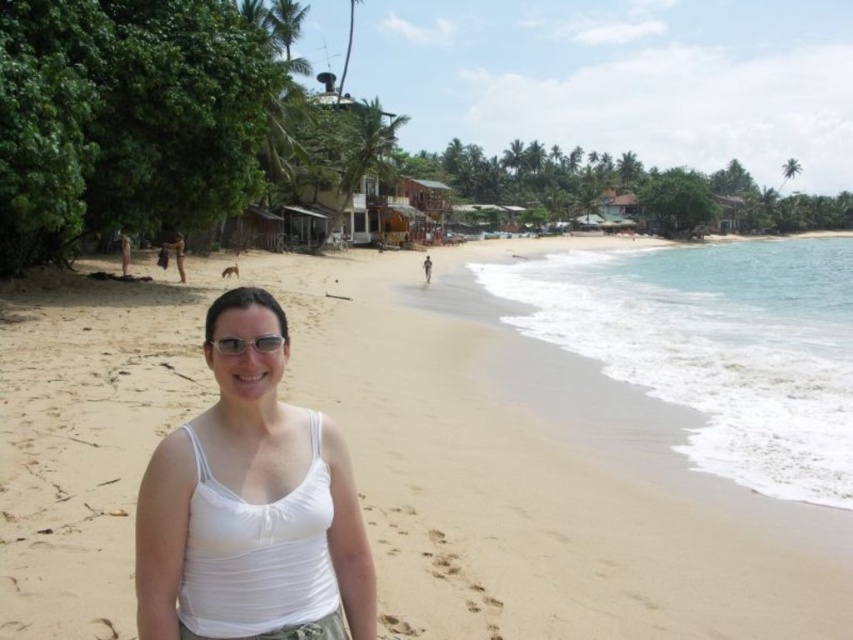
You are standing at the point marked by the coordinates point (534,472) in the beach scene. Based on the description, what is the immediate surface you would be standing on?

The immediate surface you would be standing on is light beige sand at center, as the point (534,472) marks this location.